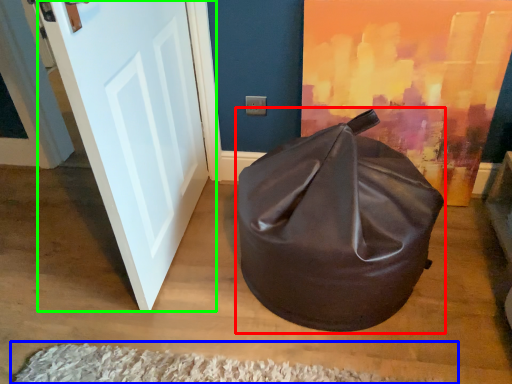
Question: Which object is positioned closest to bean bag chair (highlighted by a red box)? Select from doormat (highlighted by a blue box) and door (highlighted by a green box).

Choices:
 (A) doormat
 (B) door

Answer: (A)